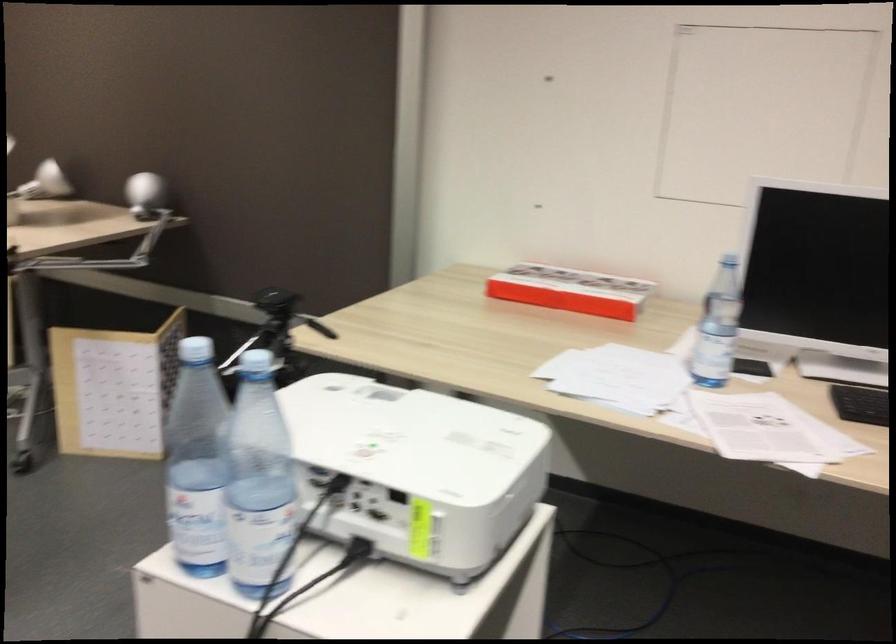
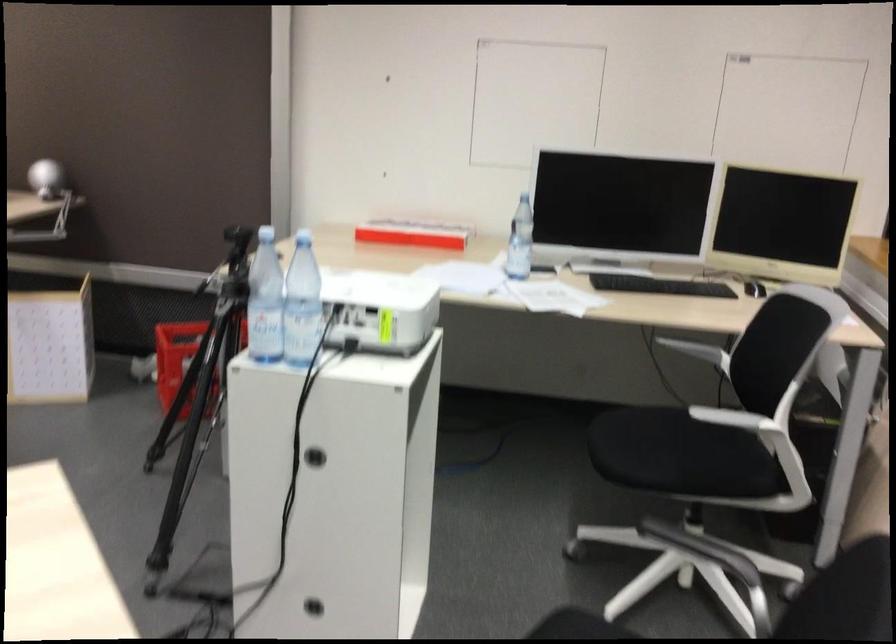
Where in the second image is the point corresponding to the point at 721,328 from the first image?

(520, 241)